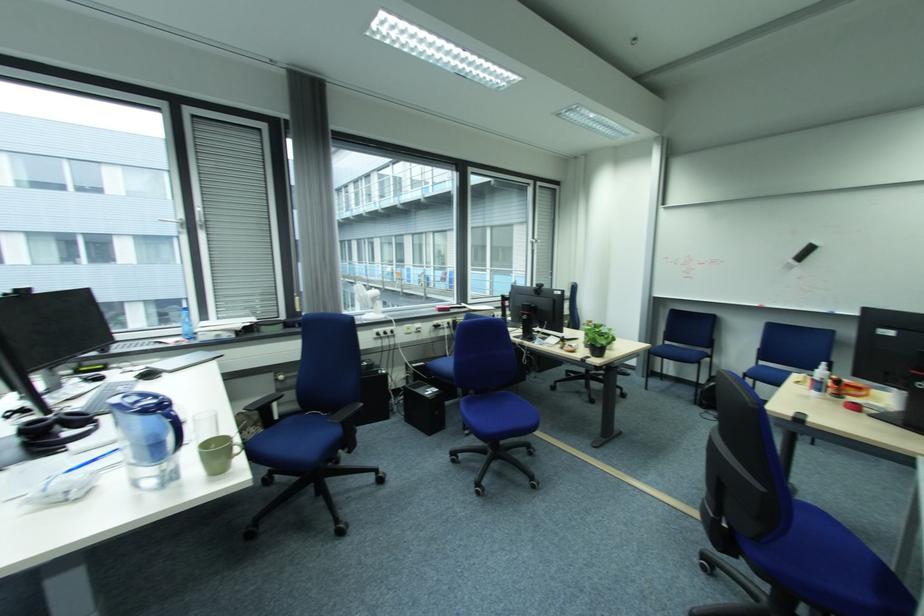
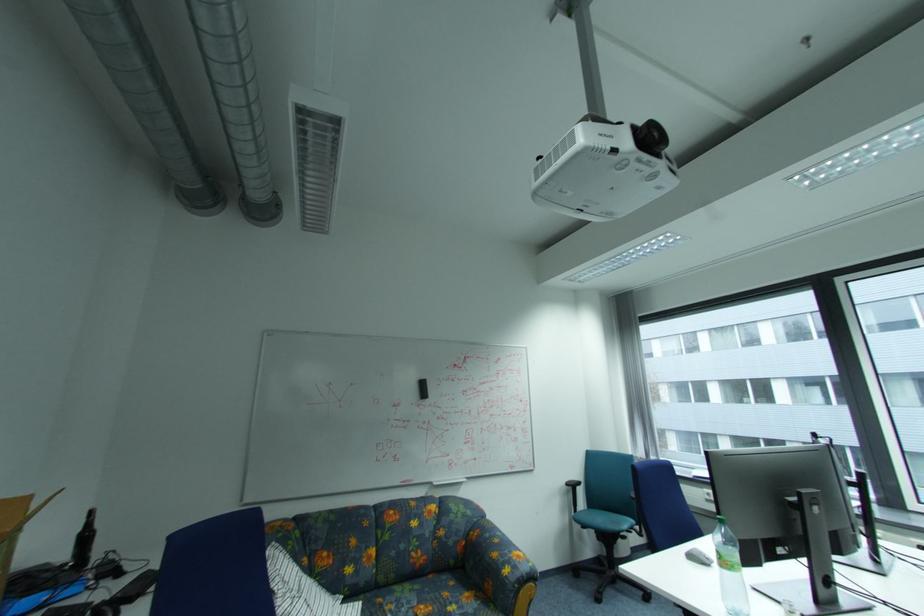
Question: The images are taken continuously from a first-person perspective. In which direction is your viewpoint rotating?

Choices:
 (A) Left
 (B) Right
 (C) Up
 (D) Down

Answer: (A)